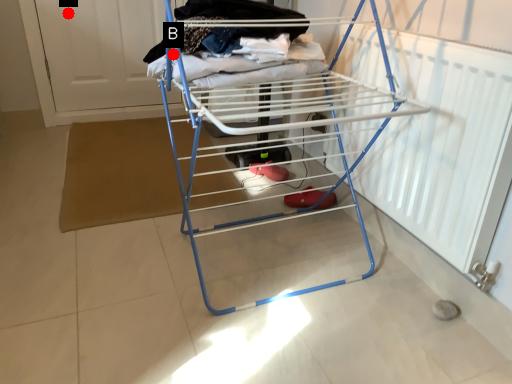
Question: Two points are circled on the image, labeled by A and B beside each circle. Which point is farther to the camera?

Choices:
 (A) A is further
 (B) B is further

Answer: (A)